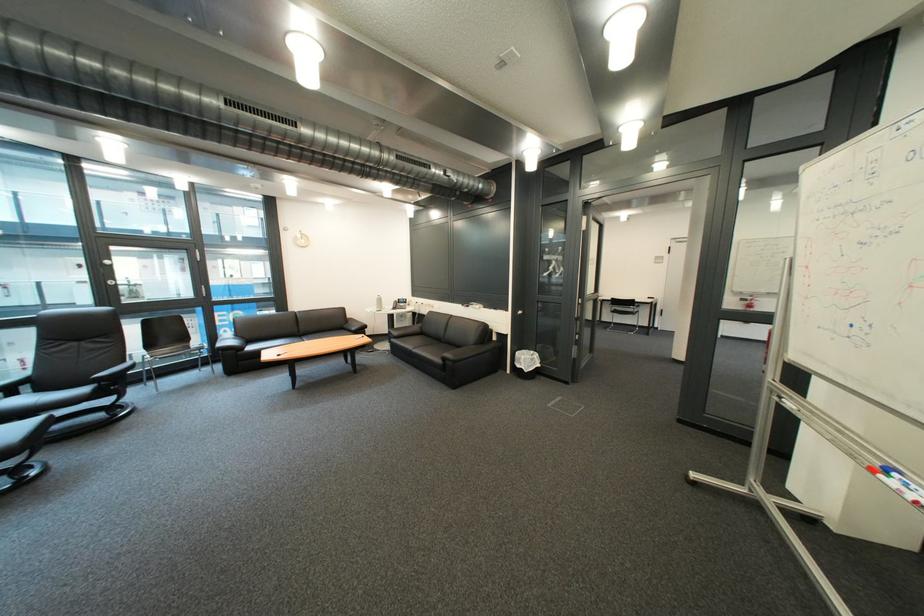
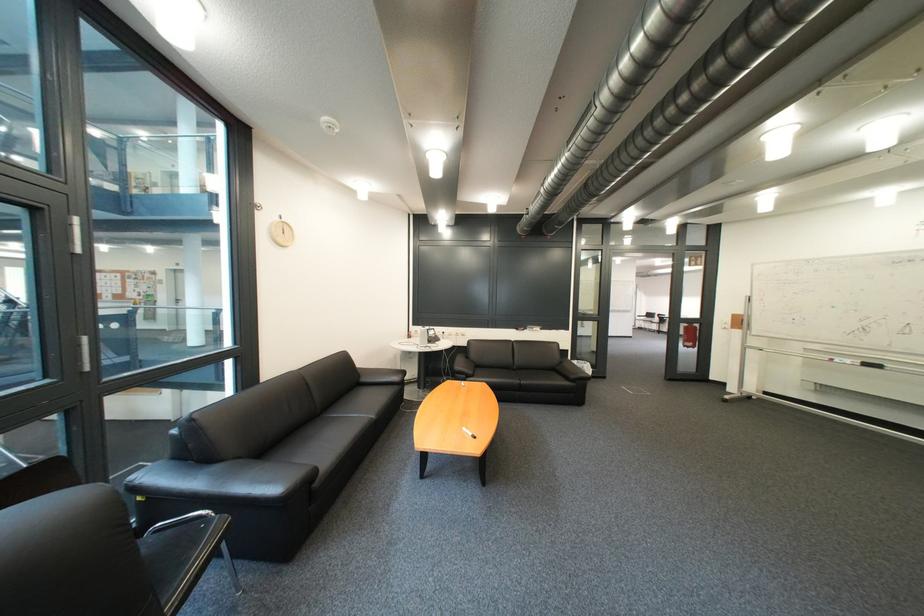
The point at (580, 385) is marked in the first image. Where is the corresponding point in the second image?

(618, 379)